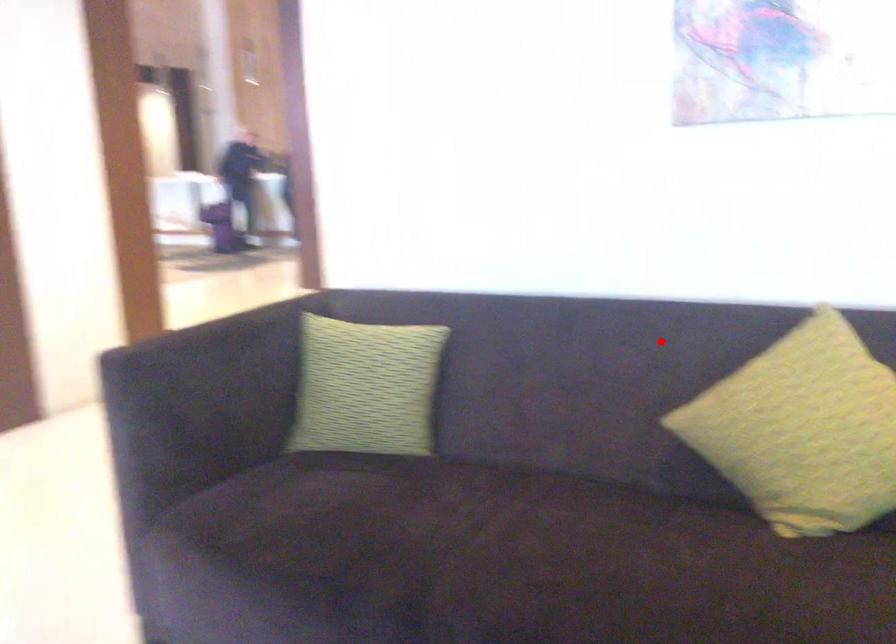
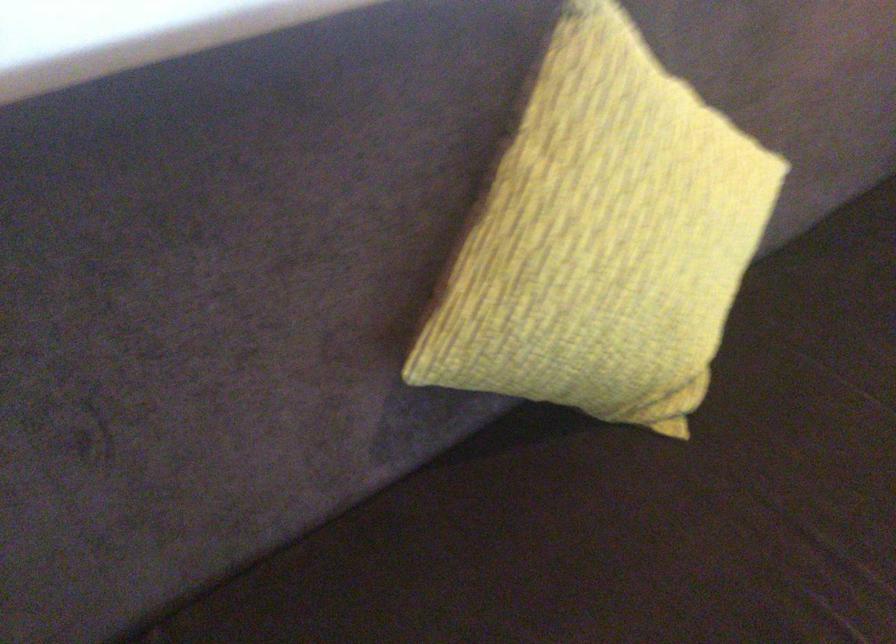
Question: A red point is marked in image1. In image2, is the corresponding 3D point closer to the camera or farther? Reply with the corresponding letter.

Choices:
 (A) The corresponding 3D point is closer.
 (B) The corresponding 3D point is farther.

Answer: (A)